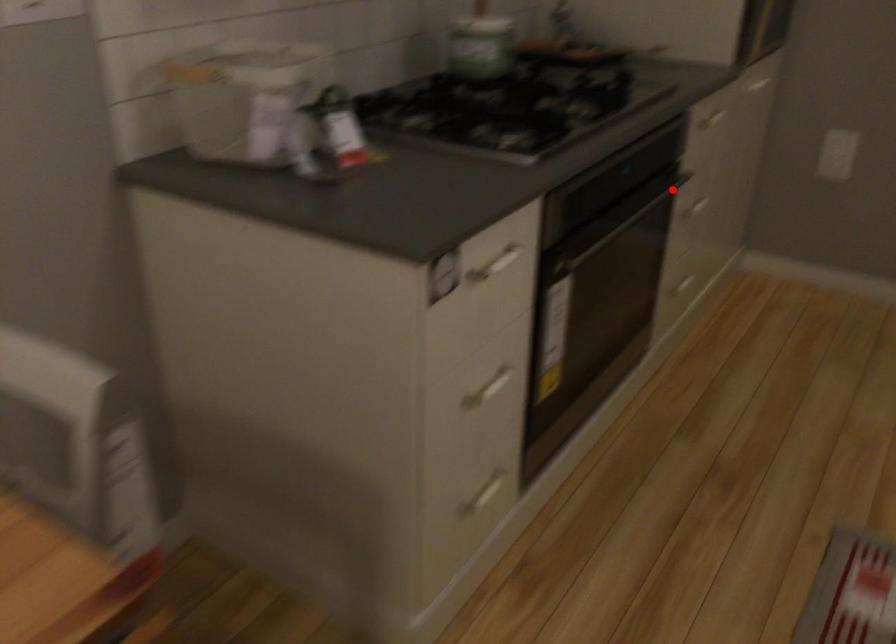
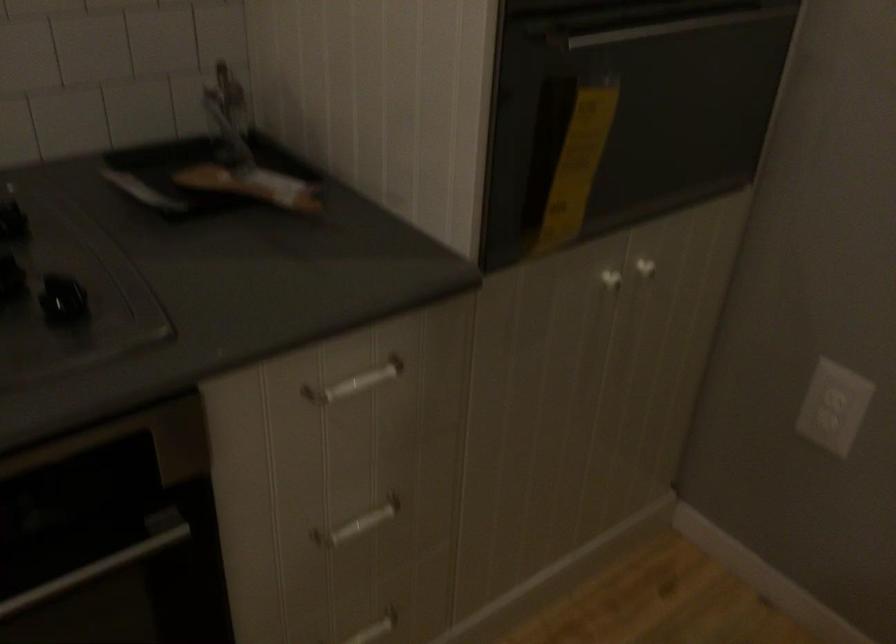
The point at the highlighted location is marked in the first image. Where is the corresponding point in the second image?

(97, 567)